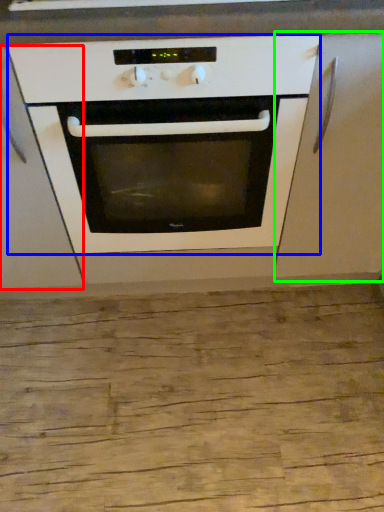
Question: Estimate the real-world distances between objects in this image. Which object is closer to cabinetry (highlighted by a red box), oven (highlighted by a blue box) or cabinetry (highlighted by a green box)?

Choices:
 (A) oven
 (B) cabinetry

Answer: (A)